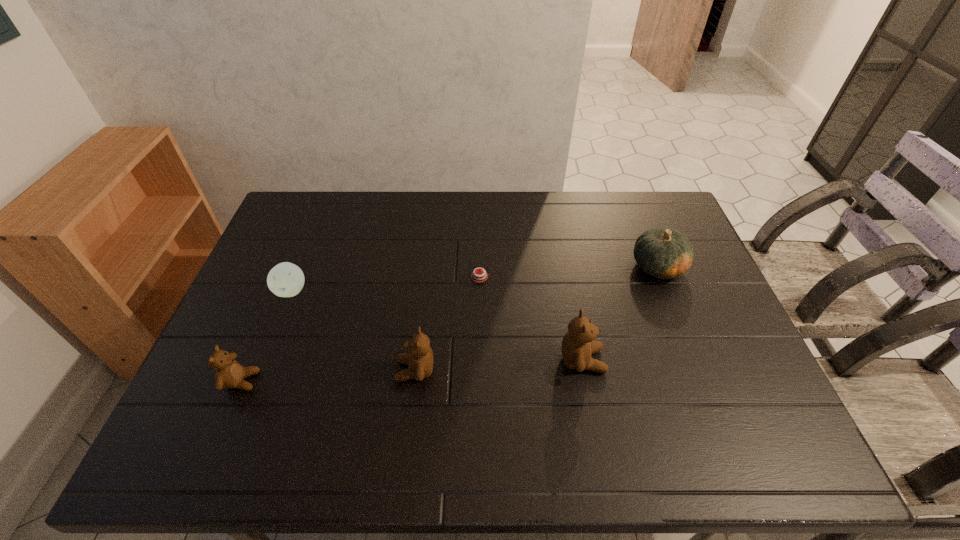
Find the location of `the shortest teddy bear`. the shortest teddy bear is located at coordinates click(x=229, y=373).

Identify the location of the second teddy bear from left to right. (419, 357).

Locate an element on the screen. the third object from left to right is located at coordinates (419, 357).

This screenshot has height=540, width=960. Identify the location of the rightmost teddy bear. (577, 345).

Where is `the fifth tallest object`? This screenshot has width=960, height=540. the fifth tallest object is located at coordinates (286, 279).

You are a GUI agent. You are given a task and a screenshot of the screen. Output one action in this format:
    pyautogui.click(x=<x>, y=<y>)
    Task: Click on the chocolate cake
    
    Given the screenshot: What is the action you would take?
    pyautogui.click(x=478, y=276)

Locate an element on the screen. The height and width of the screenshot is (540, 960). the shortest object is located at coordinates [x=478, y=276].

This screenshot has height=540, width=960. Find the location of `the rightmost object`. the rightmost object is located at coordinates (662, 252).

You are a GUI agent. You are given a task and a screenshot of the screen. Output one action in this format:
    pyautogui.click(x=<x>, y=<y>)
    Task: Click on the vacant area situated on the front-facing side of the leftmost teddy bear
    The image size is (960, 540).
    Given the screenshot: What is the action you would take?
    tap(329, 381)

Identify the location of free region located on the front-facing side of the third object from left to right. (290, 370).